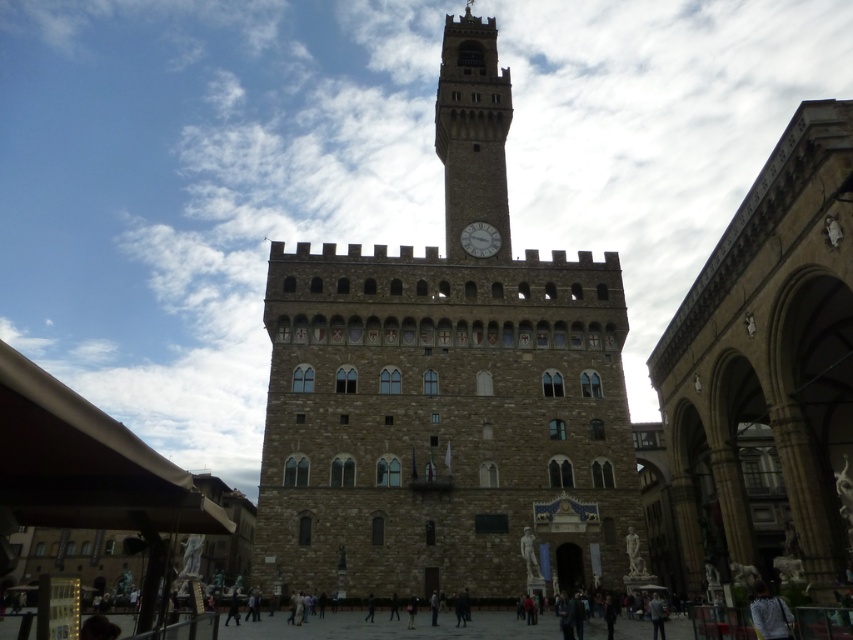
You are standing in front of the grand historical building and want to take a photo that includes both the brown stone tower at center and the brown stone clock tower at upper center. Which tower should you position closer to the camera to ensure both are in the frame?

You should position the brown stone tower at center closer to the camera since it is already closer to the viewer than the brown stone clock tower at upper center, ensuring both are visible in the frame.

You are a tourist standing in front of the grand historical building. You notice the brown stone clock tower at upper center and the white glossy clock at center. Which object is located higher up in the image?

The brown stone clock tower at upper center is positioned over the white glossy clock at center, so it is higher up in the image.

You are an architect visiting this historical building. You notice the brown stone tower at center and the white glossy clock at center. Which structure would you estimate has a greater overall height?

The brown stone tower at center is larger in size than the white glossy clock at center, so it likely has a greater overall height.